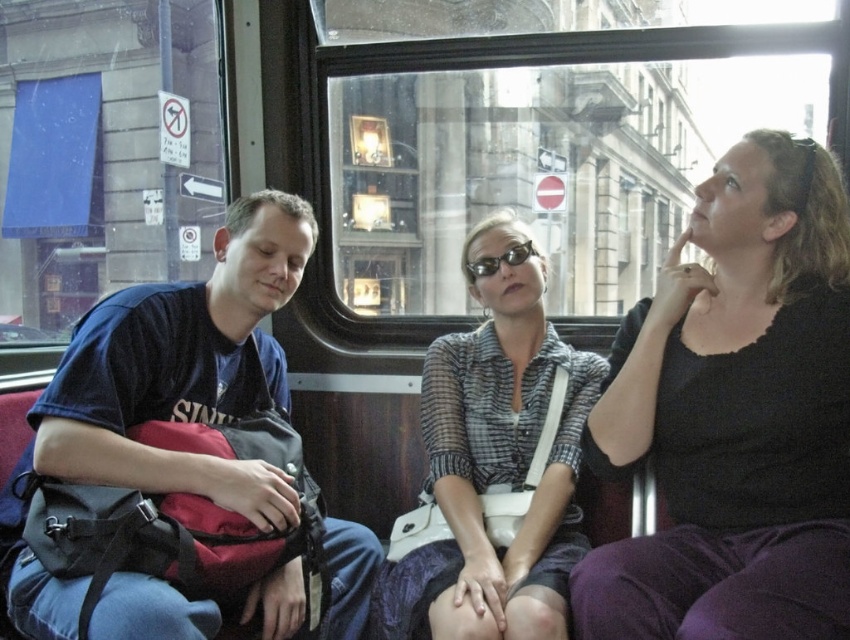
Question: Can you confirm if matte blue shirt at left is positioned to the left of plaid shirt at center?

Choices:
 (A) no
 (B) yes

Answer: (B)

Question: Is matte blue shirt at left bigger than plaid shirt at center?

Choices:
 (A) no
 (B) yes

Answer: (B)

Question: Which of the following is the closest to the observer?

Choices:
 (A) black plastic sunglasses at center
 (B) matte blue shirt at left
 (C) plaid shirt at center
 (D) black matte shirt at upper right

Answer: (D)

Question: Which object is the closest to the black matte shirt at upper right?

Choices:
 (A) black plastic sunglasses at center
 (B) plaid shirt at center
 (C) matte blue shirt at left

Answer: (B)

Question: Does black matte shirt at upper right have a lesser width compared to plaid shirt at center?

Choices:
 (A) yes
 (B) no

Answer: (A)

Question: Which point appears farthest from the camera in this image?

Choices:
 (A) (834, 512)
 (B) (517, 248)
 (C) (97, 390)

Answer: (B)